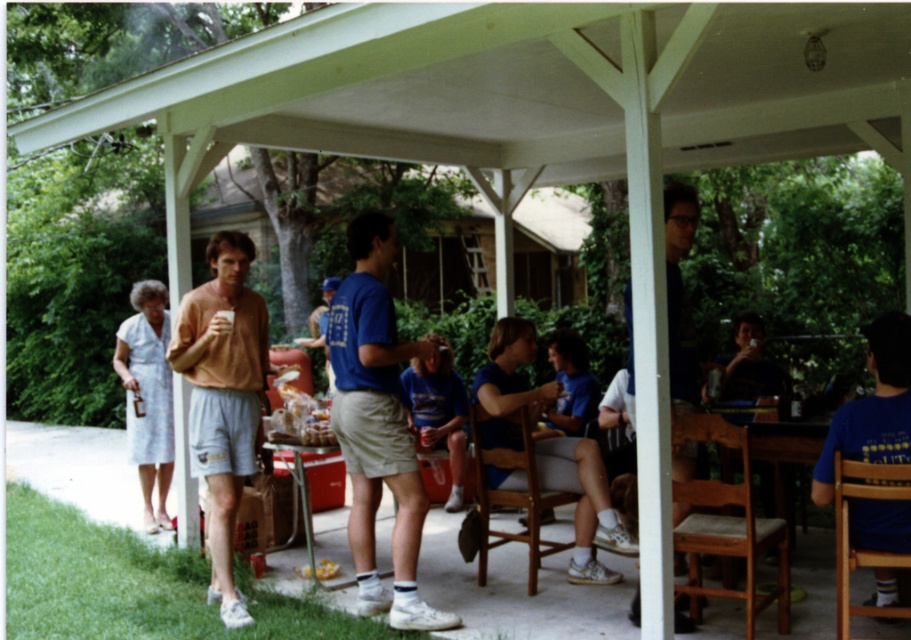
You are a photographer trying to capture a group photo under the pergola. You notice the matte orange shirt at left and the metallic silver table at lower center. Which object should you adjust your camera angle to focus on first if you want to ensure both are in frame without moving the camera?

The matte orange shirt at left is taller than the metallic silver table at lower center, so you should focus on the matte orange shirt at left first to ensure the camera angle accommodates its height, allowing the metallic silver table at lower center to naturally fit into the frame.